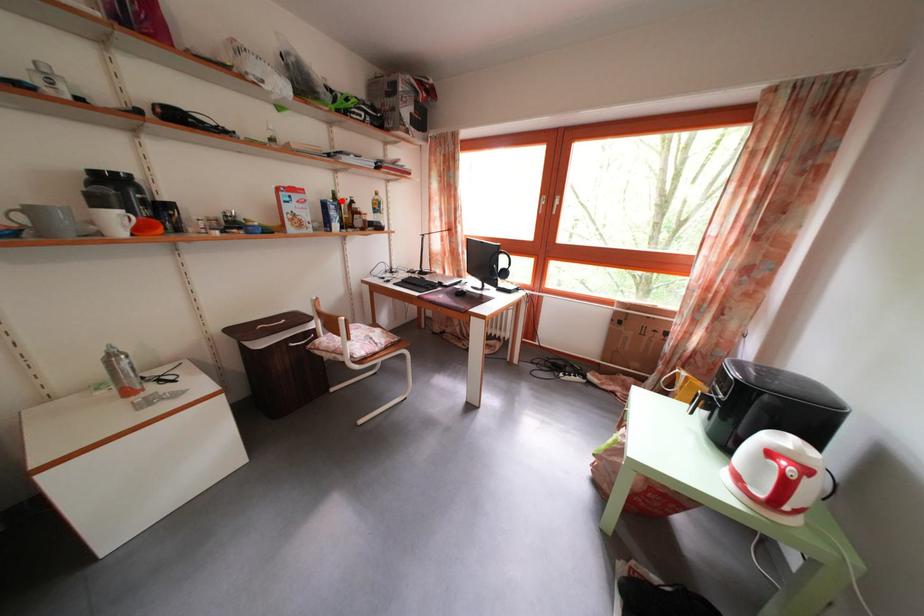
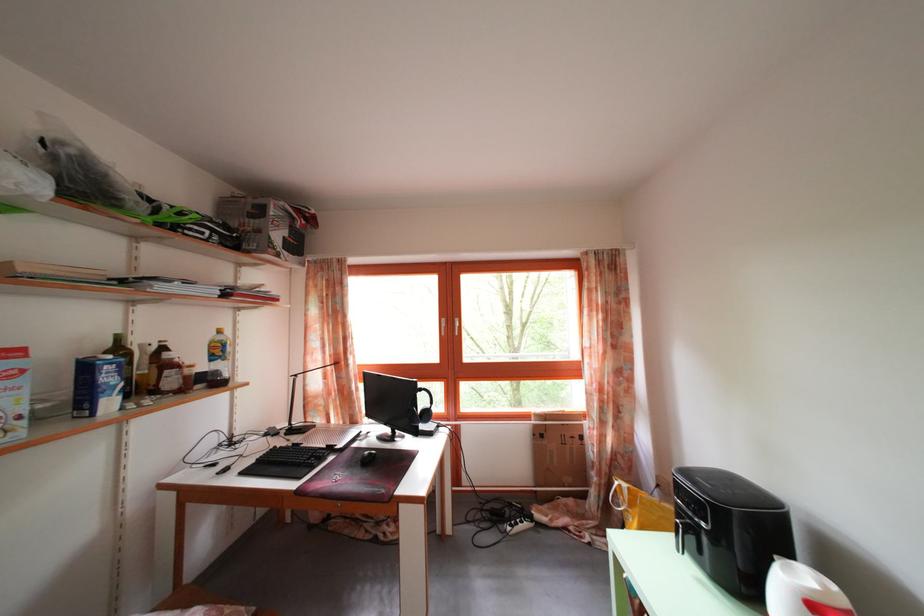
Find the pixel in the second image that matches the highlighted location in the first image.

(126, 346)